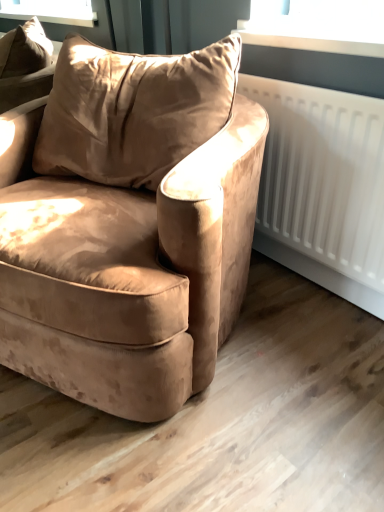
The height and width of the screenshot is (512, 384). What are the coordinates of `suede-like beige armchair at center-left` in the screenshot? It's located at (132, 229).

In order to face suede-like beige armchair at center-left, should I rotate leftwards or rightwards?

A 12.606 degree turn to the left will do.

Describe the element at coordinates (132, 229) in the screenshot. I see `suede-like beige armchair at center-left` at that location.

Where is `suede-like beige armchair at center-left`? The width and height of the screenshot is (384, 512). suede-like beige armchair at center-left is located at coordinates (132, 229).